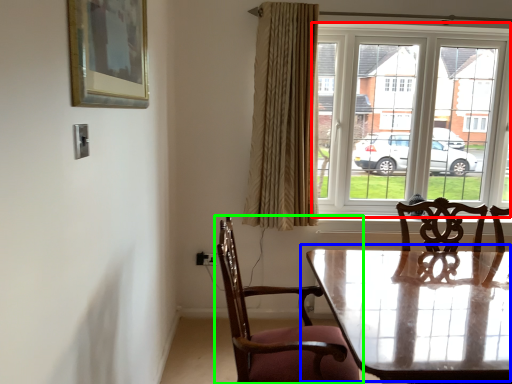
Question: Which object is the farthest from window (highlighted by a red box)? Choose among these: table (highlighted by a blue box) or chair (highlighted by a green box).

Choices:
 (A) table
 (B) chair

Answer: (B)